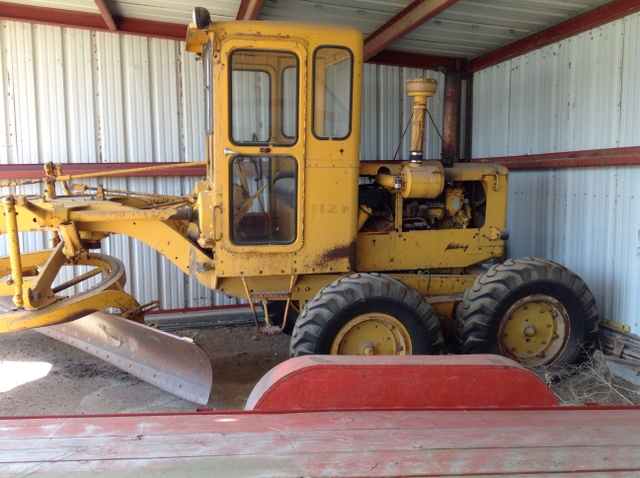
Locate an element on the screen. The width and height of the screenshot is (640, 478). wodden planks is located at coordinates [x=364, y=444], [x=364, y=408], [x=360, y=477].